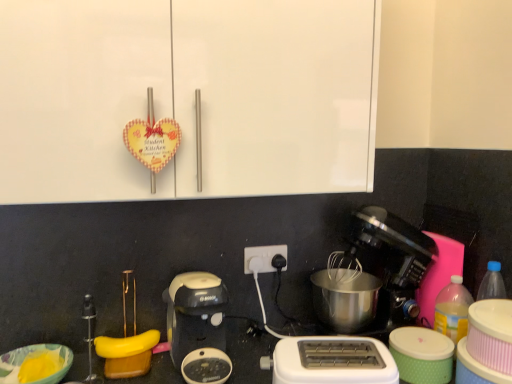
Question: From a real-world perspective, does black plastic coffee maker at lower center, the second coffee maker viewed from the right, sit lower than green textured container at lower right?

Choices:
 (A) yes
 (B) no

Answer: (B)

Question: Is the position of black plastic coffee maker at lower center, which is counted as the first coffee maker, starting from the left, more distant than that of green textured container at lower right?

Choices:
 (A) no
 (B) yes

Answer: (A)

Question: Considering the relative sizes of black plastic coffee maker at lower center, which is counted as the first coffee maker, starting from the left, and green textured container at lower right in the image provided, is black plastic coffee maker at lower center, which is counted as the first coffee maker, starting from the left, smaller than green textured container at lower right?

Choices:
 (A) yes
 (B) no

Answer: (B)

Question: From the image's perspective, is black plastic coffee maker at lower center, which is counted as the first coffee maker, starting from the left, on green textured container at lower right?

Choices:
 (A) yes
 (B) no

Answer: (A)

Question: Is black plastic coffee maker at lower center, the second coffee maker viewed from the right, wider than green textured container at lower right?

Choices:
 (A) no
 (B) yes

Answer: (B)

Question: From a real-world perspective, is black plastic coffee maker at lower center, which is counted as the first coffee maker, starting from the left, located higher than green textured container at lower right?

Choices:
 (A) yes
 (B) no

Answer: (A)

Question: Does black plastic coffee maker at lower center, the second coffee maker viewed from the right, have a lesser height compared to yellow rubber band at lower center?

Choices:
 (A) yes
 (B) no

Answer: (B)

Question: From the image's perspective, would you say black plastic coffee maker at lower center, the second coffee maker viewed from the right, is positioned over yellow rubber band at lower center?

Choices:
 (A) no
 (B) yes

Answer: (B)

Question: Is black plastic coffee maker at lower center, the second coffee maker viewed from the right, smaller than yellow rubber band at lower center?

Choices:
 (A) yes
 (B) no

Answer: (B)

Question: Is black plastic coffee maker at lower center, the second coffee maker viewed from the right, positioned before yellow rubber band at lower center?

Choices:
 (A) yes
 (B) no

Answer: (A)

Question: Does black plastic coffee maker at lower center, which is counted as the first coffee maker, starting from the left, have a lesser width compared to yellow rubber band at lower center?

Choices:
 (A) no
 (B) yes

Answer: (A)

Question: Is black plastic coffee maker at lower center, which is counted as the first coffee maker, starting from the left, outside of yellow rubber band at lower center?

Choices:
 (A) yes
 (B) no

Answer: (A)

Question: Is black plastic power plugs at center located within black plastic coffee maker at lower center, the second coffee maker viewed from the right?

Choices:
 (A) no
 (B) yes

Answer: (A)